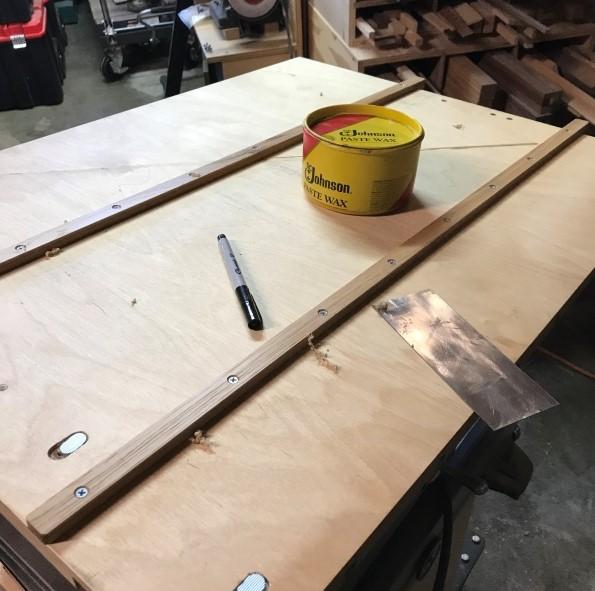
At what (x,y) coordinates should I click in order to perform the action: click on floor. Please return your answer as a coordinate pair (x, y). The height and width of the screenshot is (591, 595). Looking at the image, I should click on (519, 554).